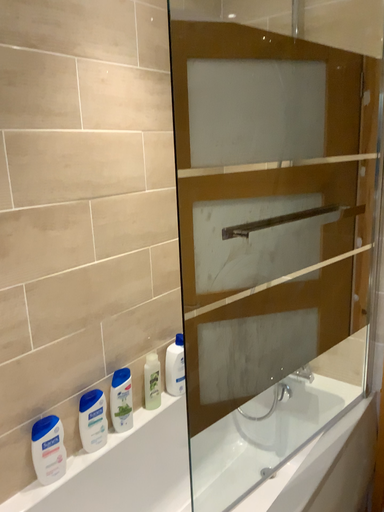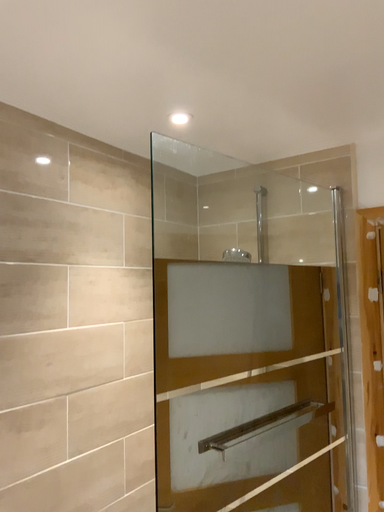
Question: Which way did the camera rotate in the video?

Choices:
 (A) rotated downward
 (B) rotated upward

Answer: (B)